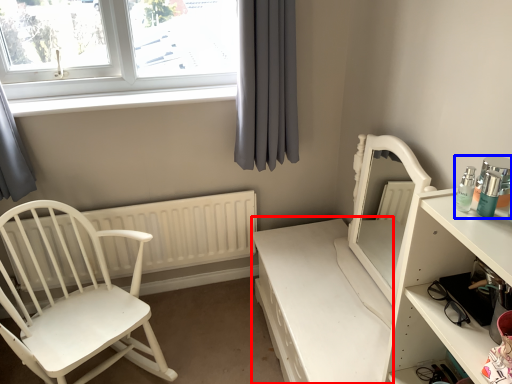
Question: Which point is closer to the camera, vanity (highlighted by a red box) or toiletry (highlighted by a blue box)?

Choices:
 (A) vanity
 (B) toiletry

Answer: (B)